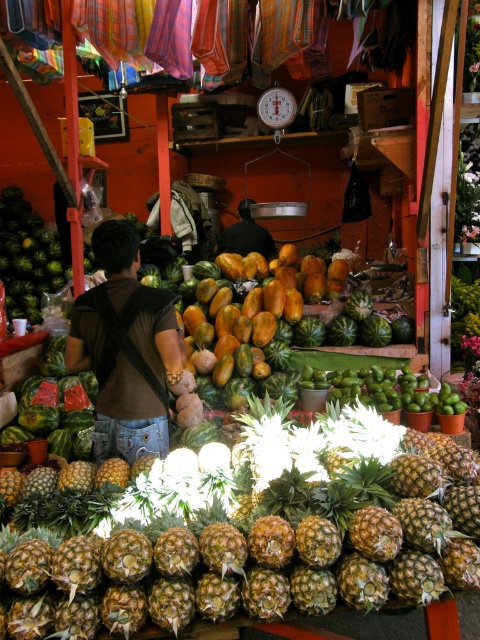
Between point (130, 577) and point (139, 381), which one is positioned behind?

The point (139, 381) is behind.

Between green rough pineapple at center and brown leather backpack at center, which one is positioned lower?

green rough pineapple at center is lower down.

Which is in front, point (56, 582) or point (166, 323)?

Positioned in front is point (56, 582).

Where is `green rough pineapple at center`? The height and width of the screenshot is (640, 480). green rough pineapple at center is located at coordinates (264, 532).

Is brown leather backpack at center to the left of black fabric at center from the viewer's perspective?

Indeed, brown leather backpack at center is positioned on the left side of black fabric at center.

Is point (168, 420) more distant than point (224, 241)?

No, it is in front of (224, 241).

Identify the location of brown leather backpack at center. (126, 348).

How far apart are green rough pineapple at center and black fabric at center?

4.82 meters

Can you confirm if green rough pineapple at center is taller than black fabric at center?

No.

Locate an element on the screen. The height and width of the screenshot is (640, 480). green rough pineapple at center is located at coordinates (264, 532).